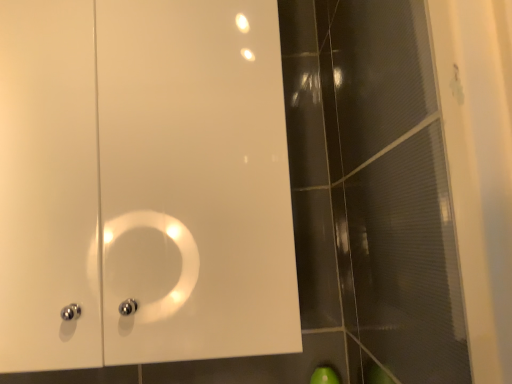
Question: Does point (339, 130) appear closer or farther from the camera than point (188, 311)?

Choices:
 (A) closer
 (B) farther

Answer: (B)

Question: Considering the positions of transparent textured glass door at right and white glossy cabinet at upper left in the image, is transparent textured glass door at right bigger or smaller than white glossy cabinet at upper left?

Choices:
 (A) small
 (B) big

Answer: (A)

Question: Visually, is transparent textured glass door at right positioned to the left or to the right of white glossy cabinet at upper left?

Choices:
 (A) left
 (B) right

Answer: (B)

Question: Is white glossy cabinet at upper left to the left or to the right of transparent textured glass door at right in the image?

Choices:
 (A) right
 (B) left

Answer: (B)

Question: Considering the positions of white glossy cabinet at upper left and transparent textured glass door at right in the image, is white glossy cabinet at upper left bigger or smaller than transparent textured glass door at right?

Choices:
 (A) small
 (B) big

Answer: (B)

Question: Considering the positions of white glossy cabinet at upper left and transparent textured glass door at right in the image, is white glossy cabinet at upper left taller or shorter than transparent textured glass door at right?

Choices:
 (A) tall
 (B) short

Answer: (B)

Question: From the image's perspective, relative to transparent textured glass door at right, is white glossy cabinet at upper left above or below?

Choices:
 (A) above
 (B) below

Answer: (A)